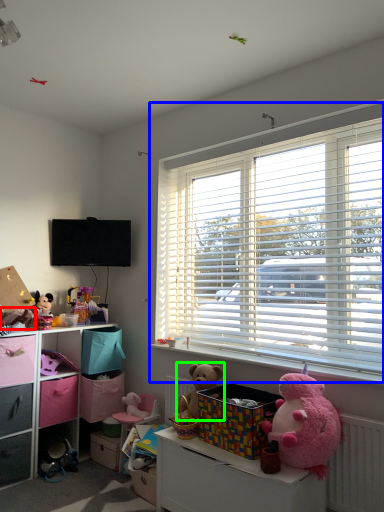
Question: Which object is positioned closest to toy (highlighted by a red box)? Select from window (highlighted by a blue box) and teddy bear (highlighted by a green box).

Choices:
 (A) window
 (B) teddy bear

Answer: (B)